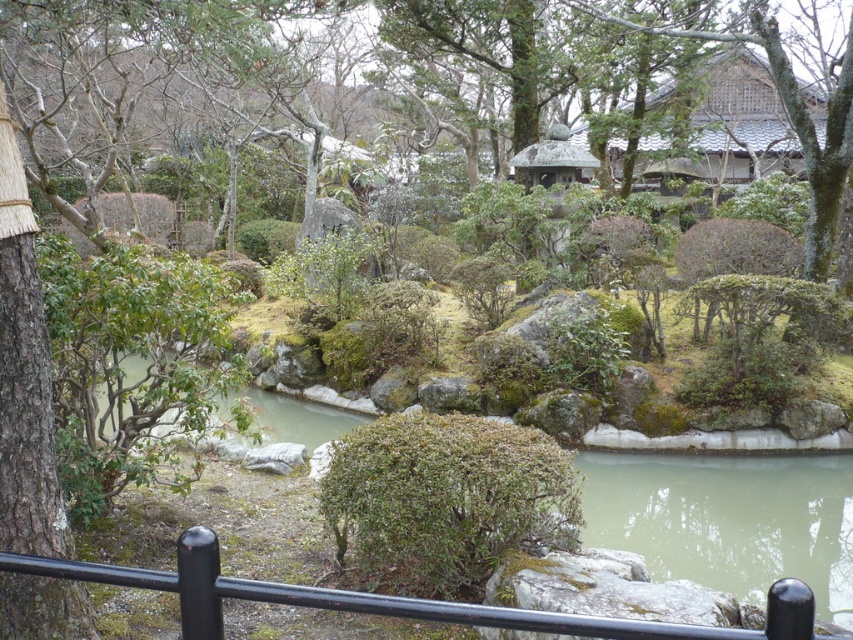
You are a visitor in the garden and want to reach the smooth stone gazebo at center from where you are standing. The path leads directly to it from the black metal fence at lower center. If your walking speed is 1.5 meters per second, how many seconds will it take you to reach the gazebo?

The black metal fence at lower center is 9.00 meters from the smooth stone gazebo at center. At a walking speed of 1.5 meters per second, it will take 6 seconds to reach the gazebo.

You are standing on a pathway in the Japanese garden and see the green leafy bush at center and the gray tiled roof at upper right. Which object is closer to you?

The green leafy bush at center is closer to you because it is in front of the gray tiled roof at upper right.